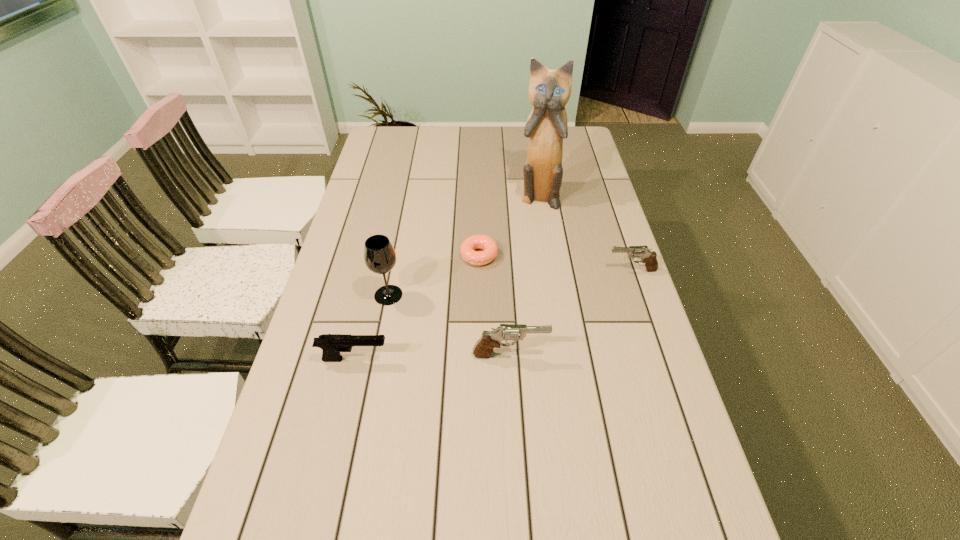
You are a GUI agent. You are given a task and a screenshot of the screen. Output one action in this format:
    pyautogui.click(x=<x>, y=<y>)
    Task: Click on the free location located 0.100m at the barrel of the third tallest object
    
    Given the screenshot: What is the action you would take?
    pyautogui.click(x=588, y=355)

Locate an element on the screen. vacant space located 0.350m at the barrel of the farthest pistol is located at coordinates (490, 270).

Locate an element on the screen. blank area located at the barrel of the farthest pistol is located at coordinates (546, 270).

Locate an element on the screen. vacant region located 0.340m at the barrel of the farthest pistol is located at coordinates (492, 270).

Where is `vacant region located 0.130m on the face of the farthest object`? The height and width of the screenshot is (540, 960). vacant region located 0.130m on the face of the farthest object is located at coordinates (x=544, y=235).

Where is `vacant space located on the front of the wineglass`? This screenshot has height=540, width=960. vacant space located on the front of the wineglass is located at coordinates (380, 335).

Where is `vacant space located on the back of the shortest object`? vacant space located on the back of the shortest object is located at coordinates click(x=479, y=200).

This screenshot has height=540, width=960. In order to click on vacant point located on the front-facing side of the leftmost pistol in this screenshot , I will do `click(449, 359)`.

Identify the location of wineglass that is at the left edge. (x=379, y=255).

At what (x,y) coordinates should I click in order to perform the action: click on pistol present at the left edge. Please return your answer as a coordinate pair (x, y). The image size is (960, 540). Looking at the image, I should click on (332, 344).